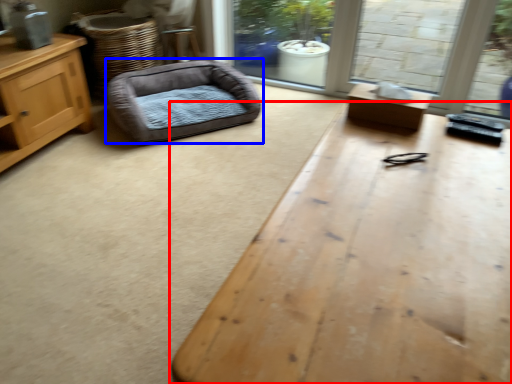
Question: Among these objects, which one is farthest to the camera, table (highlighted by a red box) or dog bed (highlighted by a blue box)?

Choices:
 (A) table
 (B) dog bed

Answer: (B)